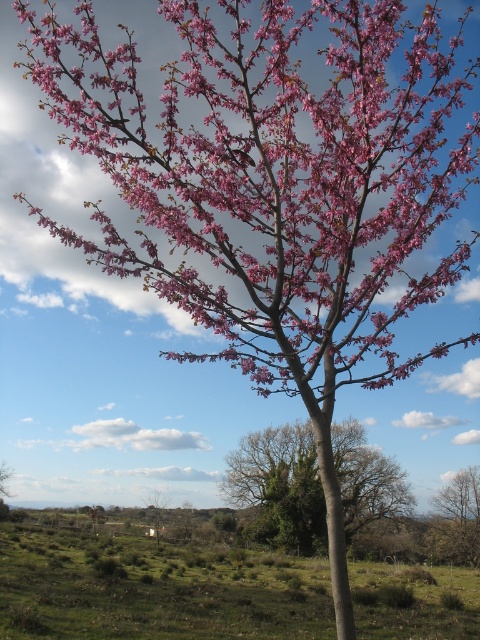
You are a hiker who wants to take a photo of the green rough bark tree at center and the pink matte tree at center. Since you have a wide angle lens, which tree should you stand closer to in order to capture both in the frame?

The green rough bark tree at center is larger in size than pink matte tree at center, so you should stand closer to the pink matte tree at center to ensure both trees fit within the frame.

You are standing in a park and see a tree with a point marked at coordinates (278,486). Based on the description, where on the tree is this point located?

The point at coordinates (278,486) is located on the green rough bark tree at center.

You are a painter standing at the edge of a field, looking at the green rough bark tree at center and the green matte house at center. Which object would you say is wider in your view?

The green rough bark tree at center is wider than the green matte house at center in your view.